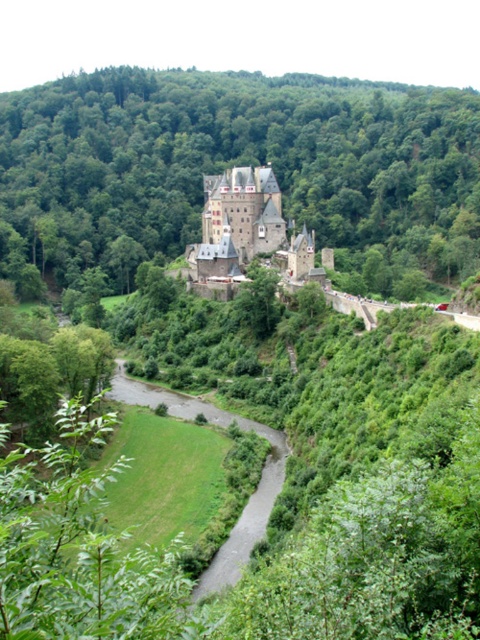
Which is in front, point (29, 150) or point (264, 237)?

Point (264, 237)

From the picture: Between green leafy tree at center and stone medieval castle at center, which one appears on the left side from the viewer's perspective?

Positioned to the left is stone medieval castle at center.

Who is more forward, (373, 116) or (201, 275)?

Point (201, 275)

The height and width of the screenshot is (640, 480). I want to click on green leafy tree at center, so click(x=240, y=164).